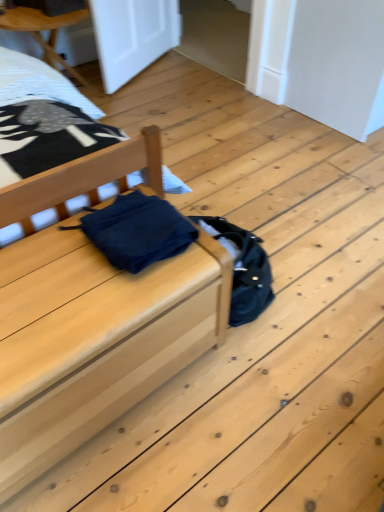
Question: Visually, is matte wood bed at center positioned to the left or to the right of dark blue fabric at center?

Choices:
 (A) right
 (B) left

Answer: (B)

Question: Considering the positions of matte wood bed at center and dark blue fabric at center in the image, is matte wood bed at center bigger or smaller than dark blue fabric at center?

Choices:
 (A) small
 (B) big

Answer: (B)

Question: Which of these objects is positioned closest to the white textured sheet at upper left?

Choices:
 (A) matte blue fabric at center
 (B) matte wood bed at center
 (C) dark blue fabric at center

Answer: (A)

Question: Which object is the closest to the dark blue fabric at center?

Choices:
 (A) matte blue fabric at center
 (B) white textured sheet at upper left
 (C) matte wood bed at center

Answer: (C)